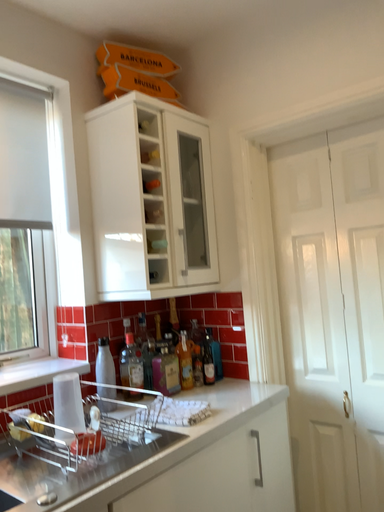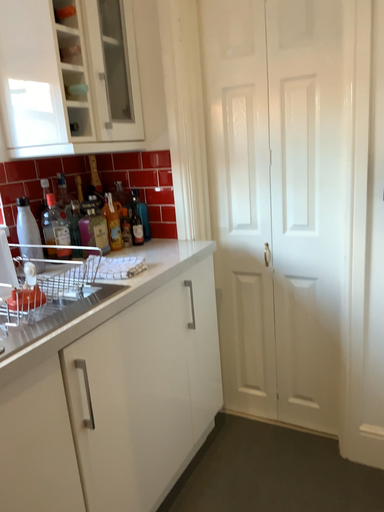
Question: How did the camera likely rotate when shooting the video?

Choices:
 (A) rotated left
 (B) rotated right

Answer: (B)